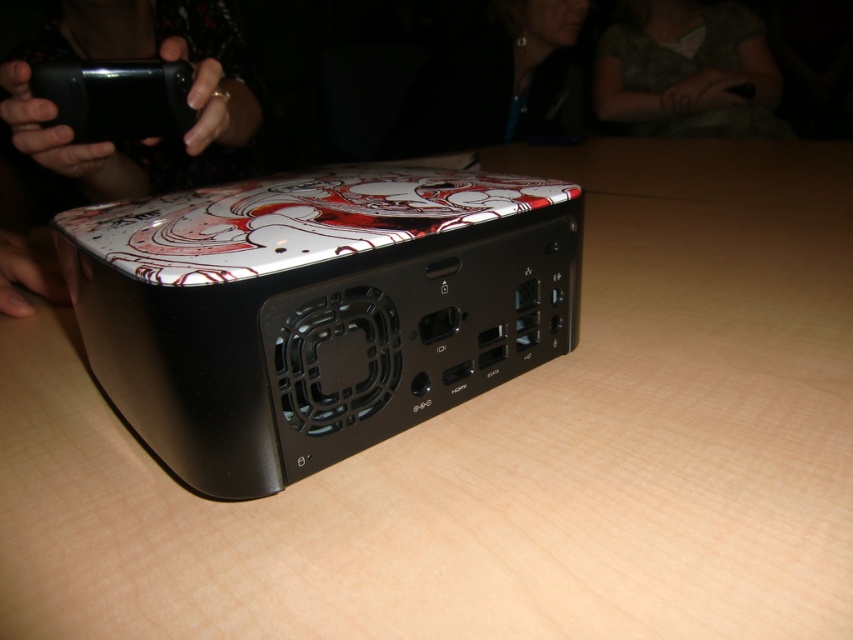
You are organizing items on a desk and need to place both the matte black phone at upper left and the green textured shirt at upper center. Based on their positions, which item is more accessible to you without moving your current position?

The matte black phone at upper left is closer to the viewer than the green textured shirt at upper center, so it is more accessible without moving.

You are organizing items on a desk and need to place the green textured shirt at upper center and the black glossy phone at upper left. Based on their positions, which item is closer to you?

The green textured shirt at upper center is closer to you because the black glossy phone at upper left is behind it.

You are setting up a home office and want to place a wireless charger on the table between the glossy plastic box at center and the black glossy phone at upper left. The charger has a diameter of 4 inches. Is there enough space between them to fit the charger?

The glossy plastic box at center is 18.69 inches from the black glossy phone at upper left. Since the charger requires 4 inches of space, there is sufficient room between them to place the charger.